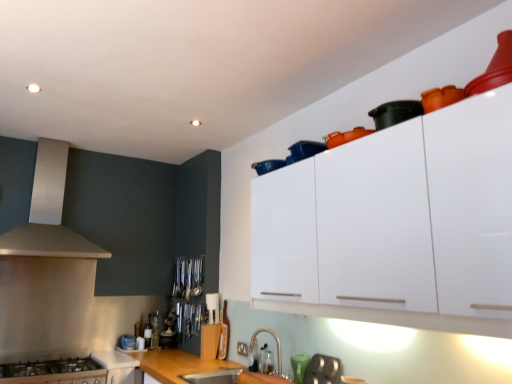
Question: Is teal glass at lower center completely or partially outside of satin nickel faucet at lower center?

Choices:
 (A) no
 (B) yes

Answer: (B)

Question: Is teal glass at lower center looking in the opposite direction of satin nickel faucet at lower center?

Choices:
 (A) yes
 (B) no

Answer: (B)

Question: From the image's perspective, is teal glass at lower center on satin nickel faucet at lower center?

Choices:
 (A) yes
 (B) no

Answer: (B)

Question: Is the surface of teal glass at lower center in direct contact with satin nickel faucet at lower center?

Choices:
 (A) no
 (B) yes

Answer: (A)

Question: Considering the relative sizes of teal glass at lower center and satin nickel faucet at lower center in the image provided, is teal glass at lower center taller than satin nickel faucet at lower center?

Choices:
 (A) no
 (B) yes

Answer: (A)

Question: From the image's perspective, is satin nickel faucet at lower center positioned above or below stainless steel stove at lower left, the first cabinetry positioned from the bottom?

Choices:
 (A) above
 (B) below

Answer: (A)

Question: In terms of width, does satin nickel faucet at lower center look wider or thinner when compared to stainless steel stove at lower left, the first cabinetry positioned from the bottom?

Choices:
 (A) wide
 (B) thin

Answer: (B)

Question: Relative to stainless steel stove at lower left, which is the second cabinetry from front to back, is satin nickel faucet at lower center in front or behind?

Choices:
 (A) behind
 (B) front

Answer: (B)

Question: Is satin nickel faucet at lower center bigger or smaller than stainless steel stove at lower left, positioned as the 2th cabinetry in right-to-left order?

Choices:
 (A) big
 (B) small

Answer: (B)

Question: From a real-world perspective, is white glossy cabinet at upper right, the 1th cabinetry when ordered from top to bottom, physically located above or below orange matte pot at upper center, which is the 3th appliance from bottom to top?

Choices:
 (A) below
 (B) above

Answer: (A)

Question: Considering the positions of point (332, 291) and point (355, 134), is point (332, 291) closer or farther from the camera than point (355, 134)?

Choices:
 (A) farther
 (B) closer

Answer: (B)

Question: From the image's perspective, is white glossy cabinet at upper right, acting as the 2th cabinetry starting from the left, positioned above or below orange matte pot at upper center, which is the 3th appliance from bottom to top?

Choices:
 (A) below
 (B) above

Answer: (A)

Question: Is white glossy cabinet at upper right, which is the first cabinetry from right to left, taller or shorter than orange matte pot at upper center, which is the 3th appliance in left-to-right order?

Choices:
 (A) tall
 (B) short

Answer: (A)

Question: Considering the positions of orange matte pot at upper center, arranged as the second appliance when viewed from the right, and teal glass at lower center in the image, is orange matte pot at upper center, arranged as the second appliance when viewed from the right, bigger or smaller than teal glass at lower center?

Choices:
 (A) big
 (B) small

Answer: (B)

Question: Is orange matte pot at upper center, which is counted as the 3th appliance, starting from the back, inside or outside of teal glass at lower center?

Choices:
 (A) outside
 (B) inside

Answer: (A)